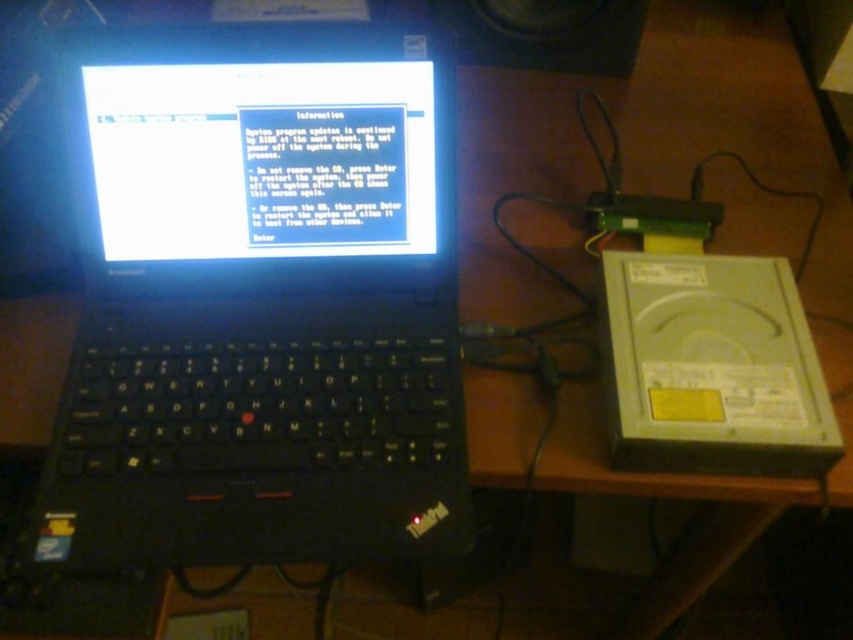
Is point (403, 481) closer to viewer compared to point (555, 38)?

Yes, it is in front of point (555, 38).

Looking at this image, does black plastic laptop at center appear on the right side of black plastic speaker at upper center?

In fact, black plastic laptop at center is to the left of black plastic speaker at upper center.

Who is more distant from viewer, (196, 294) or (619, 61)?

The point (619, 61) is more distant.

Find the location of a particular element. This screenshot has width=853, height=640. black plastic laptop at center is located at coordinates (259, 300).